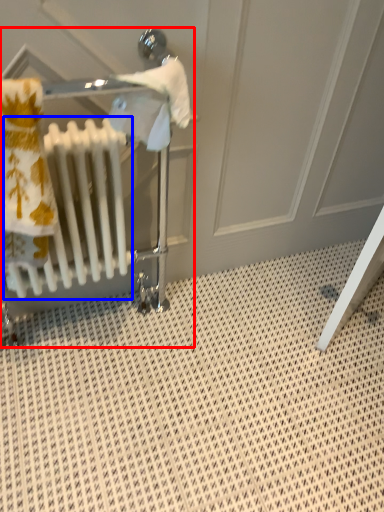
Question: Which object appears farthest to the camera in this image, baby carriage (highlighted by a red box) or radiator (highlighted by a blue box)?

Choices:
 (A) baby carriage
 (B) radiator

Answer: (A)